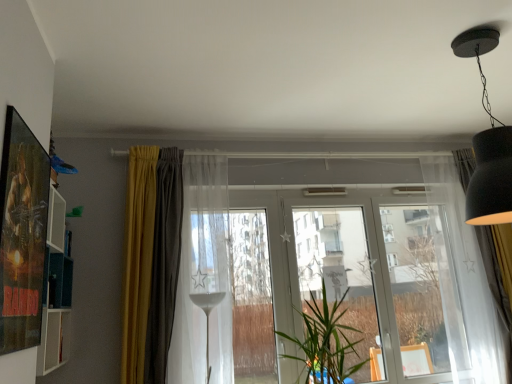
Find the location of a particular element. Image resolution: width=512 pixels, height=384 pixels. matte black lampshade at upper right is located at coordinates (487, 143).

What do you see at coordinates (487, 143) in the screenshot? The width and height of the screenshot is (512, 384). I see `matte black lampshade at upper right` at bounding box center [487, 143].

What is the approximate height of metallic poster at left?

94.34 centimeters.

Locate an element on the screen. The width and height of the screenshot is (512, 384). dark gray velvet curtain at center, which is the second curtain in left-to-right order is located at coordinates (164, 263).

From the image's perspective, relative to dark gray velvet curtain at center, acting as the 2th curtain starting from the right, is transparent glass window at center above or below?

From the image's perspective, transparent glass window at center appears below dark gray velvet curtain at center, acting as the 2th curtain starting from the right.

Can you tell me how much transparent glass window at center and dark gray velvet curtain at center, which is the second curtain in left-to-right order, differ in facing direction?

2.04 degrees.

From a real-world perspective, between transparent glass window at center and dark gray velvet curtain at center, which is the second curtain in left-to-right order, who is vertically lower?

transparent glass window at center.

Is transparent glass window at center far away from dark gray velvet curtain at center, acting as the 2th curtain starting from the right?

Indeed, transparent glass window at center is not near dark gray velvet curtain at center, acting as the 2th curtain starting from the right.

What's the angular difference between white sheer curtain at right, positioned as the 3th curtain in left-to-right order, and green leafy plant at center's facing directions?

The facing directions of white sheer curtain at right, positioned as the 3th curtain in left-to-right order, and green leafy plant at center are 2.81 degrees apart.

Is white sheer curtain at right, positioned as the 3th curtain in left-to-right order, placed right next to green leafy plant at center?

There is a gap between white sheer curtain at right, positioned as the 3th curtain in left-to-right order, and green leafy plant at center.

Would you say green leafy plant at center is part of white sheer curtain at right, positioned as the 3th curtain in left-to-right order,'s contents?

No, green leafy plant at center is not a part of white sheer curtain at right, positioned as the 3th curtain in left-to-right order.

Is green leafy plant at center positioned with its back to transparent glass window at center?

Yes, green leafy plant at center is facing away from transparent glass window at center.

Based on the photo, which is behind, green leafy plant at center or transparent glass window at center?

Positioned behind is transparent glass window at center.

From a real-world perspective, is green leafy plant at center on top of transparent glass window at center?

No, from a real-world perspective, green leafy plant at center is not over transparent glass window at center

Considering the sizes of green leafy plant at center and transparent glass window at center in the image, is green leafy plant at center bigger or smaller than transparent glass window at center?

green leafy plant at center is bigger than transparent glass window at center.

Can you see matte black lampshade at upper right touching transparent glass window at center?

There is a gap between matte black lampshade at upper right and transparent glass window at center.

Is matte black lampshade at upper right oriented towards transparent glass window at center?

No, matte black lampshade at upper right is not oriented towards transparent glass window at center.

From a real-world perspective, is matte black lampshade at upper right physically below transparent glass window at center?

No, from a real-world perspective, matte black lampshade at upper right is not under transparent glass window at center.

From the image's perspective, between matte black lampshade at upper right and transparent glass window at center, who is located below?

transparent glass window at center appears lower in the image.

Considering the relative positions of transparent glass window frame at center and metallic poster at left in the image provided, is transparent glass window frame at center to the left of metallic poster at left from the viewer's perspective?

Incorrect, transparent glass window frame at center is not on the left side of metallic poster at left.

Find the location of a particular element. The image size is (512, 384). window frame behind the metallic poster at left is located at coordinates (251, 298).

Is transparent glass window frame at center not within metallic poster at left?

Yes.

Considering the relative sizes of transparent glass window frame at center and transparent glass screen door at center, which appears as the first screen door when viewed from the left, in the image provided, is transparent glass window frame at center thinner than transparent glass screen door at center, which appears as the first screen door when viewed from the left,?

Incorrect, the width of transparent glass window frame at center is not less than that of transparent glass screen door at center, which appears as the first screen door when viewed from the left.

Based on the photo, is transparent glass window frame at center aimed at transparent glass screen door at center, which appears as the first screen door when viewed from the left?

No, transparent glass window frame at center is not turned towards transparent glass screen door at center, which appears as the first screen door when viewed from the left.

Measure the distance between transparent glass window frame at center and transparent glass screen door at center, the 2th screen door when ordered from right to left.

21.29 inches.

From a real-world perspective, relative to transparent glass screen door at center, the 2th screen door when ordered from right to left, is transparent glass window frame at center vertically above or below?

From a real-world perspective, transparent glass window frame at center is physically above transparent glass screen door at center, the 2th screen door when ordered from right to left.

Visually, is transparent glass window frame at center positioned to the left or to the right of transparent glass screen door at center, the second screen door in the left-to-right sequence?

Based on their positions, transparent glass window frame at center is located to the left of transparent glass screen door at center, the second screen door in the left-to-right sequence.

How far apart are transparent glass window frame at center and transparent glass screen door at center, the second screen door in the left-to-right sequence?

A distance of 1.30 meters exists between transparent glass window frame at center and transparent glass screen door at center, the second screen door in the left-to-right sequence.

Is transparent glass window frame at center thinner than transparent glass screen door at center, the second screen door in the left-to-right sequence?

Incorrect, the width of transparent glass window frame at center is not less than that of transparent glass screen door at center, the second screen door in the left-to-right sequence.

From a real-world perspective, is transparent glass window frame at center over transparent glass screen door at center, positioned as the first screen door in right-to-left order?

Yes.

Where is `window that appears below the dark gray velvet curtain at center, acting as the 2th curtain starting from the right (from a real-world perspective)`? This screenshot has width=512, height=384. window that appears below the dark gray velvet curtain at center, acting as the 2th curtain starting from the right (from a real-world perspective) is located at coordinates (394, 269).

Starting from the green leafy plant at center, which curtain is the 3rd one behind? Please provide its 2D coordinates.

[(496, 285)]

Considering their positions, is transparent glass window at center positioned closer to transparent glass wine glass at center than metallic poster at left?

transparent glass window at center is positioned closer to the anchor transparent glass wine glass at center.

Based on the photo, estimate the real-world distances between objects in this image. Which object is closer to matte black lampshade at upper right, yellow fabric curtain at left, placed as the 3th curtain when sorted from right to left, or green leafy plant at center?

green leafy plant at center is closer to matte black lampshade at upper right.

In the scene shown: From the image, which object appears to be farther from transparent glass window at center, transparent glass screen door at center, which appears as the first screen door when viewed from the left, or white sheer curtain at right, positioned as the 3th curtain in left-to-right order?

white sheer curtain at right, positioned as the 3th curtain in left-to-right order, is further to transparent glass window at center.

Considering their positions, is yellow fabric curtain at left, placed as the 3th curtain when sorted from right to left, positioned closer to matte black lampshade at upper right than transparent glass window at center?

transparent glass window at center is positioned closer to the anchor matte black lampshade at upper right.

Based on their spatial positions, is dark gray velvet curtain at center, acting as the 2th curtain starting from the right, or transparent glass screen door at center, the 2th screen door when ordered from right to left, closer to white sheer curtain at right, which is the 1th curtain in right-to-left order?

Among the two, transparent glass screen door at center, the 2th screen door when ordered from right to left, is located nearer to white sheer curtain at right, which is the 1th curtain in right-to-left order.

From the image, which object appears to be farther from green leafy plant at center, dark gray velvet curtain at center, acting as the 2th curtain starting from the right, or transparent glass wine glass at center?

dark gray velvet curtain at center, acting as the 2th curtain starting from the right, lies further to green leafy plant at center than the other object.

Consider the image. Considering their positions, is transparent glass window at center positioned closer to metallic poster at left than transparent glass window frame at center?

transparent glass window frame at center lies closer to metallic poster at left than the other object.

Consider the image. Considering their positions, is metallic poster at left positioned closer to transparent glass window at center than transparent glass screen door at center, the 2th screen door when ordered from right to left?

The object closer to transparent glass window at center is transparent glass screen door at center, the 2th screen door when ordered from right to left.

Locate an element on the screen. The image size is (512, 384). window located between metallic poster at left and white sheer curtain at right, which is the 1th curtain in right-to-left order, in the left-right direction is located at coordinates (394, 269).

This screenshot has width=512, height=384. I want to click on houseplant situated between metallic poster at left and matte black lampshade at upper right from left to right, so click(325, 342).

Identify the location of houseplant situated between transparent glass window frame at center and transparent glass window at center from left to right. (325, 342).

This screenshot has width=512, height=384. Identify the location of houseplant between yellow fabric curtain at left, placed as the 3th curtain when sorted from right to left, and transparent glass screen door at center, which appears as the first screen door when viewed from the left, from left to right. (325, 342).